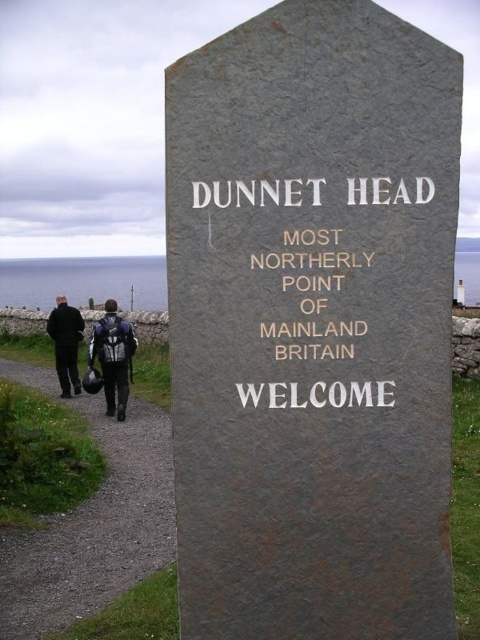
How far apart are dirt/gravel path at lower left and dark wool coat at lower left?

dirt/gravel path at lower left and dark wool coat at lower left are 4.12 meters apart.

Can you confirm if dirt/gravel path at lower left is positioned to the left of dark wool coat at lower left?

No, dirt/gravel path at lower left is not to the left of dark wool coat at lower left.

Locate an element on the screen. The image size is (480, 640). dirt/gravel path at lower left is located at coordinates (95, 529).

How much distance is there between dirt/gravel path at lower left and goldmaterial/texturetext at center?

dirt/gravel path at lower left is 3.09 meters from goldmaterial/texturetext at center.

What do you see at coordinates (95, 529) in the screenshot? I see `dirt/gravel path at lower left` at bounding box center [95, 529].

Where is `dirt/gravel path at lower left`? dirt/gravel path at lower left is located at coordinates (95, 529).

Does gray stone monument at center appear on the right side of goldmaterial/texturetext at center?

Yes, gray stone monument at center is to the right of goldmaterial/texturetext at center.

Does gray stone monument at center come behind goldmaterial/texturetext at center?

No, gray stone monument at center is in front of goldmaterial/texturetext at center.

Who is more distant from viewer, (191, 189) or (354, 352)?

Positioned behind is point (354, 352).

Locate an element on the screen. This screenshot has height=640, width=480. gray stone monument at center is located at coordinates (312, 324).